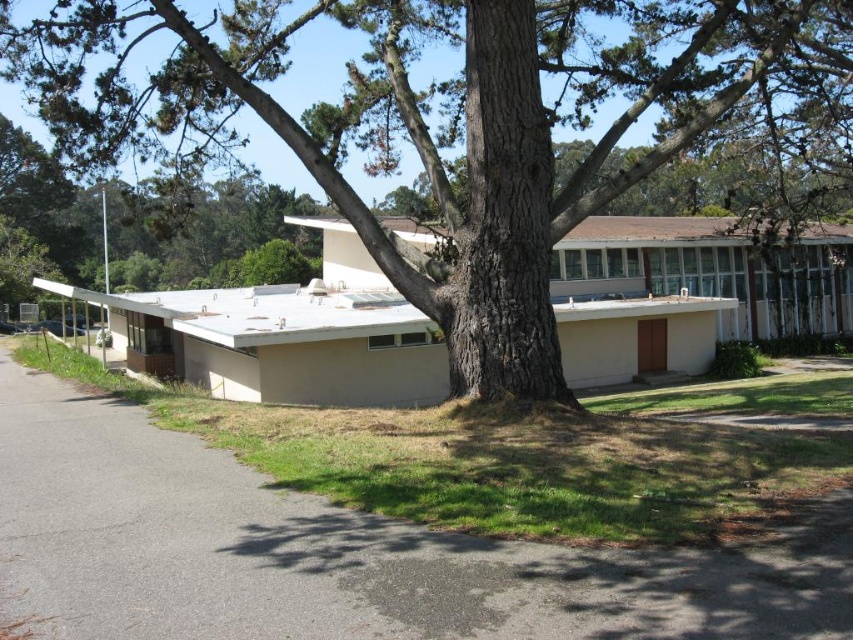
You are a landscape architect designing a new pathway near the brown rough tree at center and the gray asphalt driveway at lower left. Considering their sizes, which object should you prioritize for space allocation in your design?

The brown rough tree at center has a larger size compared to the gray asphalt driveway at lower left, so you should prioritize allocating more space to accommodate the brown rough tree at center in your design.

You are a gardener planning to plant a new flower bed between the brown rough tree at center and the gray asphalt driveway at lower left. Considering their sizes, which object will cast more shade over the flower bed during the day?

The brown rough tree at center is much taller than the gray asphalt driveway at lower left, so it will cast more shade over the flower bed during the day.

Consider the image. You are a landscape architect designing a pathway between the brown rough tree at center and the gray asphalt driveway at lower left. Which object is wider to ensure the pathway accommodates a 3 meter wide truck?

The brown rough tree at center is wider than the gray asphalt driveway at lower left, so the pathway should be designed around the gray asphalt driveway at lower left to accommodate the truck.